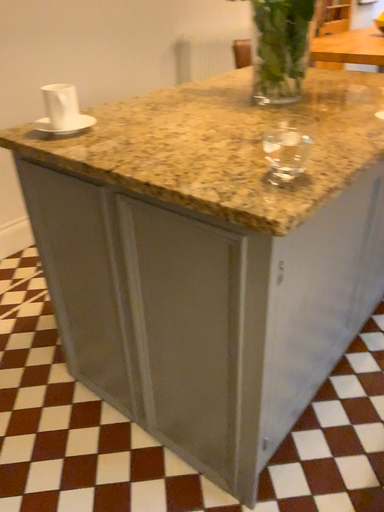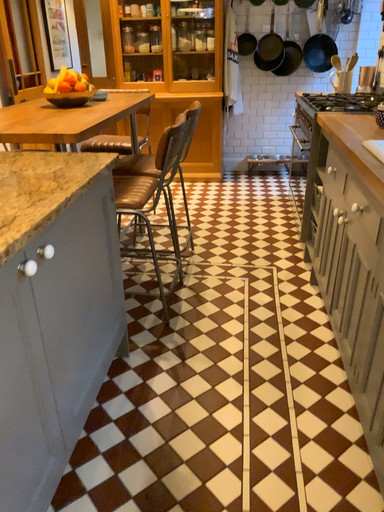
Question: Which way did the camera rotate in the video?

Choices:
 (A) rotated right
 (B) rotated left

Answer: (A)